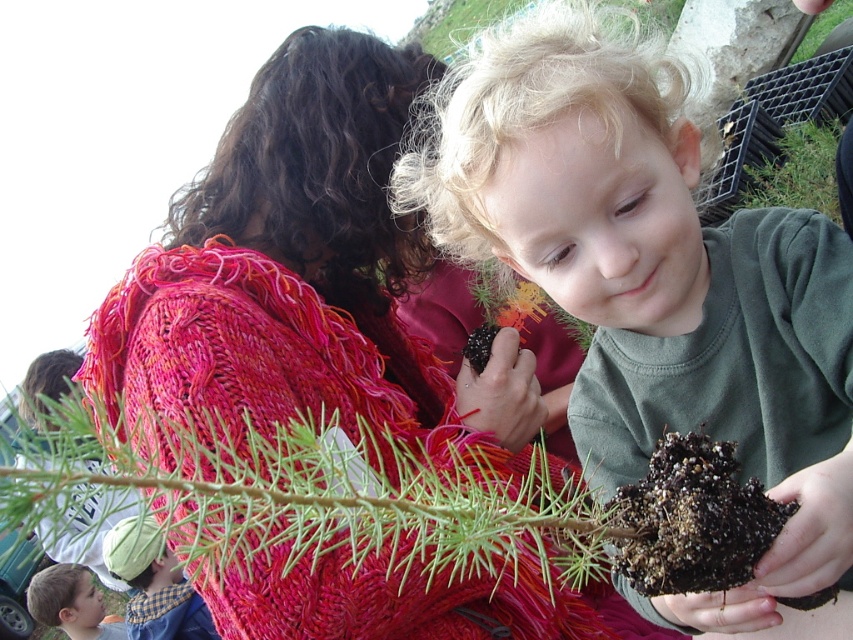
Looking at the scene described, which object is positioned to the left of the other between the knitted wool scarf at upper center and the brown fuzzy plant at upper center?

The knitted wool scarf at upper center is positioned to the left of the brown fuzzy plant at upper center.

You are a photographer taking a portrait of the smooth skin face at lower left and the brown fuzzy plant at upper center. Since the plant is much taller than the face, how should you adjust your camera angle to ensure both are fully visible in the photo?

To ensure both the smooth skin face at lower left and the brown fuzzy plant at upper center are fully visible in the photo, you should angle your camera downward because the brown fuzzy plant at upper center is much taller than the smooth skin face at lower left.